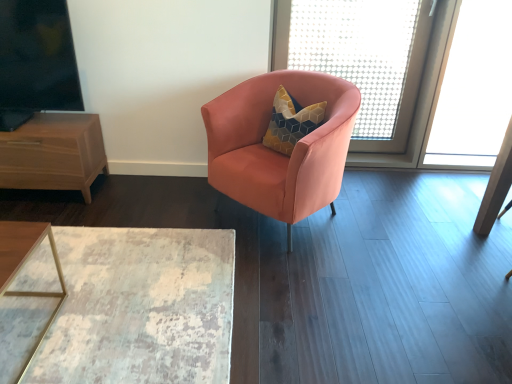
Identify the location of unoccupied space behind distressed wood table at lower left. (144, 203).